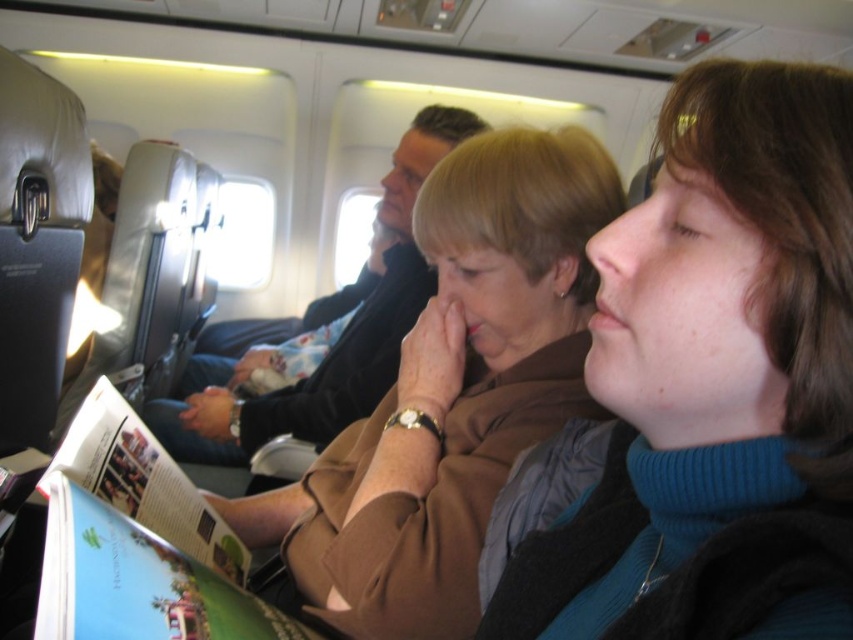
Question: Can you confirm if blue fleece at center is positioned above brown fabric jacket at center?

Choices:
 (A) yes
 (B) no

Answer: (B)

Question: Estimate the real-world distances between objects in this image. Which object is farther from the brown fabric jacket at center?

Choices:
 (A) matte paper magazine at center
 (B) blue fleece at center

Answer: (B)

Question: Does brown fabric jacket at center have a greater width compared to matte paper magazine at center?

Choices:
 (A) no
 (B) yes

Answer: (B)

Question: Among these points, which one is nearest to the camera?

Choices:
 (A) (450, 195)
 (B) (146, 515)
 (C) (679, 468)

Answer: (C)

Question: Is brown fabric jacket at center thinner than matte paper magazine at center?

Choices:
 (A) no
 (B) yes

Answer: (A)

Question: Among these objects, which one is farthest from the camera?

Choices:
 (A) matte paper magazine at center
 (B) blue fleece at center
 (C) brown fabric jacket at center

Answer: (C)